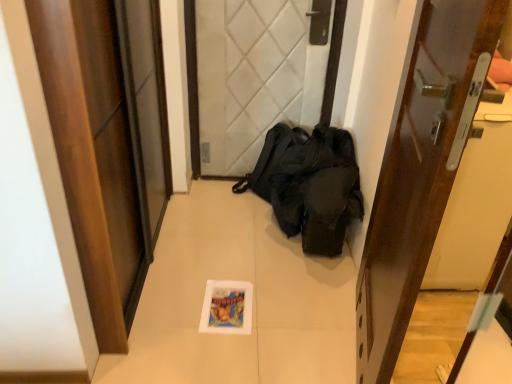
Locate an element on the screen. The height and width of the screenshot is (384, 512). vacant space to the left of wooden glossy door at right, the 1th door positioned from the right is located at coordinates (248, 314).